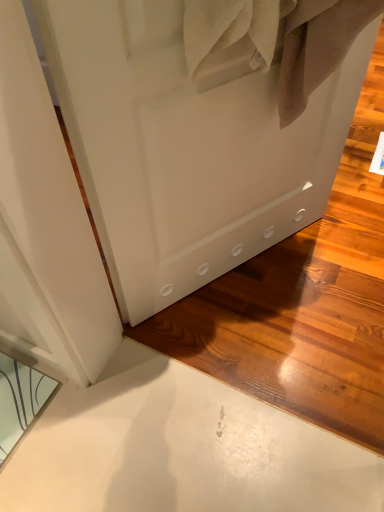
I want to click on free spot to the right of white matte door at center, so click(x=327, y=265).